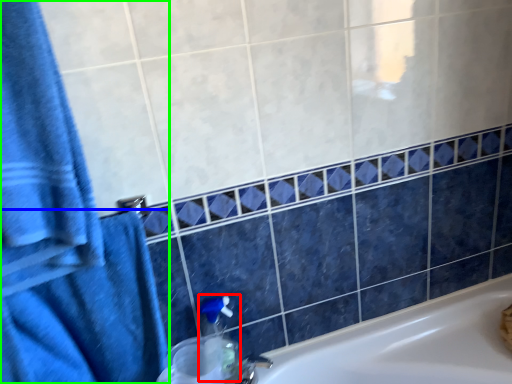
Question: Which object is positioned farthest from soap dispenser (highlighted by a red box)? Select from bath towel (highlighted by a blue box) and bath towel (highlighted by a green box).

Choices:
 (A) bath towel
 (B) bath towel

Answer: (B)